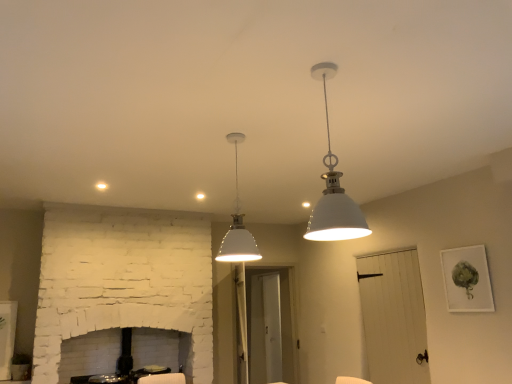
Question: From a real-world perspective, is white matte pendant light at upper center, the first lamp viewed from the front, positioned above or below white matte pendant light at center, which is the 1th lamp in left-to-right order?

Choices:
 (A) below
 (B) above

Answer: (A)

Question: Is white matte pendant light at upper center, the first lamp viewed from the front, inside or outside of white matte pendant light at center, the first lamp in the back-to-front sequence?

Choices:
 (A) outside
 (B) inside

Answer: (A)

Question: Considering the real-world distances, which object is farthest from the white matte pendant light at center, which is the 1th lamp in left-to-right order?

Choices:
 (A) white matte pendant light at upper center, which is the second lamp in left-to-right order
 (B) white wood door at lower right
 (C) matte white picture frame at upper right

Answer: (B)

Question: Based on their relative distances, which object is farther from the white wood door at lower right?

Choices:
 (A) white matte pendant light at upper center, acting as the 1th lamp starting from the right
 (B) matte white picture frame at upper right
 (C) white matte pendant light at center, which is the 1th lamp in left-to-right order

Answer: (A)